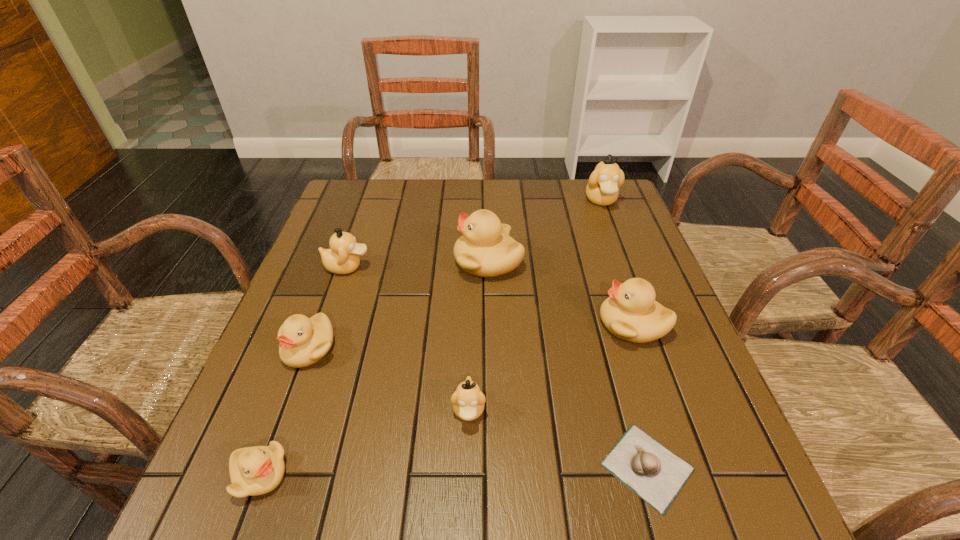
Image resolution: width=960 pixels, height=540 pixels. Identify the location of free location that satisfies the following two spatial constraints: 1. on the beak of the second biggest yellow duckling; 2. on the face of the nearest tan duckling. (662, 410).

At what (x,y) coordinates should I click in order to perform the action: click on vacant space that satisfies the following two spatial constraints: 1. on the beak of the second biggest yellow duckling; 2. on the face of the smallest tan duckling. Please return your answer as a coordinate pair (x, y). The width and height of the screenshot is (960, 540). Looking at the image, I should click on (662, 410).

You are a GUI agent. You are given a task and a screenshot of the screen. Output one action in this format:
    pyautogui.click(x=<x>, y=<y>)
    Task: Click on the free spot that satisfies the following two spatial constraints: 1. on the beak of the biggest yellow duckling; 2. on the face of the second tan duckling from left to right
    The width and height of the screenshot is (960, 540).
    Given the screenshot: What is the action you would take?
    (492, 410)

Locate an element on the screen. blank area in the image that satisfies the following two spatial constraints: 1. on the face of the second tan duckling from left to right; 2. on the beak of the smallest yellow duckling is located at coordinates (468, 475).